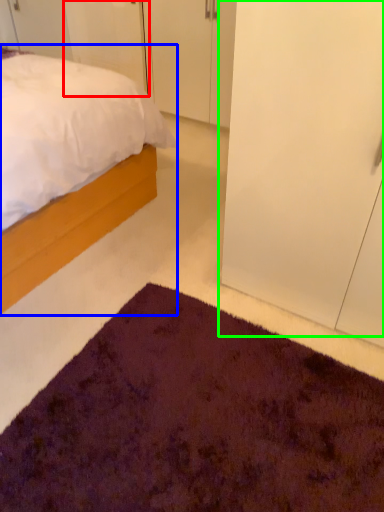
Question: Based on their relative distances, which object is farther from door (highlighted by a red box)? Choose from bed (highlighted by a blue box) and glass door (highlighted by a green box).

Choices:
 (A) bed
 (B) glass door

Answer: (B)